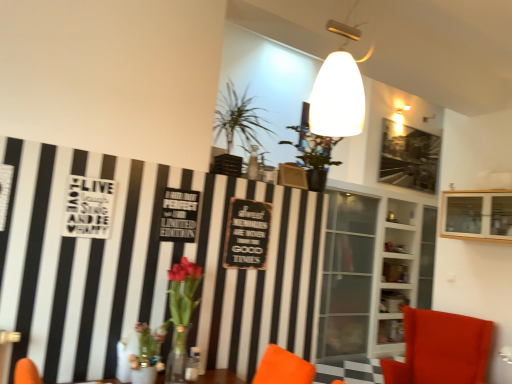
Question: From the image's perspective, is velvet orange chair at lower right located beneath translucent glass vase at lower left?

Choices:
 (A) no
 (B) yes

Answer: (B)

Question: Is velvet orange chair at lower right facing towards translucent glass vase at lower left?

Choices:
 (A) yes
 (B) no

Answer: (A)

Question: From the image's perspective, does velvet orange chair at lower right appear higher than translucent glass vase at lower left?

Choices:
 (A) no
 (B) yes

Answer: (A)

Question: Would you say velvet orange chair at lower right is outside translucent glass vase at lower left?

Choices:
 (A) no
 (B) yes

Answer: (B)

Question: Can you confirm if velvet orange chair at lower right is shorter than translucent glass vase at lower left?

Choices:
 (A) yes
 (B) no

Answer: (B)

Question: Does point (184, 314) appear closer or farther from the camera than point (498, 236)?

Choices:
 (A) farther
 (B) closer

Answer: (B)

Question: Is translucent glass vase at lower left wider or thinner than wooden cabinet at upper right, which ranks as the 2th shelf in back-to-front order?

Choices:
 (A) wide
 (B) thin

Answer: (B)

Question: From the image's perspective, is translucent glass vase at lower left located above or below wooden cabinet at upper right, which ranks as the 2th shelf in back-to-front order?

Choices:
 (A) below
 (B) above

Answer: (A)

Question: Looking at the image, does translucent glass vase at lower left seem bigger or smaller compared to wooden cabinet at upper right, the 1th shelf from the front?

Choices:
 (A) big
 (B) small

Answer: (B)

Question: Considering the positions of green leafy plant at upper center and translucent glass vase at lower left in the image, is green leafy plant at upper center bigger or smaller than translucent glass vase at lower left?

Choices:
 (A) big
 (B) small

Answer: (A)

Question: From the image's perspective, is green leafy plant at upper center positioned above or below translucent glass vase at lower left?

Choices:
 (A) above
 (B) below

Answer: (A)

Question: From a real-world perspective, is green leafy plant at upper center physically located above or below translucent glass vase at lower left?

Choices:
 (A) above
 (B) below

Answer: (A)

Question: In terms of height, does green leafy plant at upper center look taller or shorter compared to translucent glass vase at lower left?

Choices:
 (A) short
 (B) tall

Answer: (A)

Question: From the image's perspective, relative to velvet orange chair at lower right, is translucent glass vase at lower left above or below?

Choices:
 (A) below
 (B) above

Answer: (B)

Question: Considering the relative positions of translucent glass vase at lower left and velvet orange chair at lower right in the image provided, is translucent glass vase at lower left to the left or to the right of velvet orange chair at lower right?

Choices:
 (A) left
 (B) right

Answer: (A)